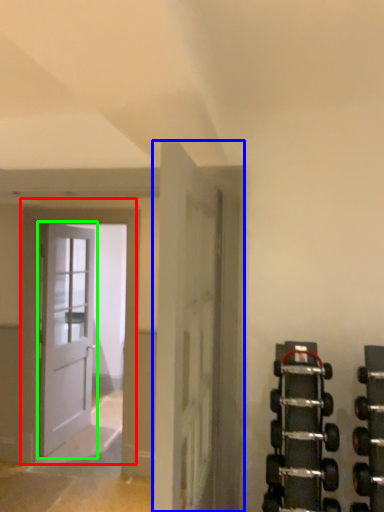
Question: Based on their relative distances, which object is nearer to door (highlighted by a red box)? Choose from door (highlighted by a blue box) and door (highlighted by a green box).

Choices:
 (A) door
 (B) door

Answer: (B)